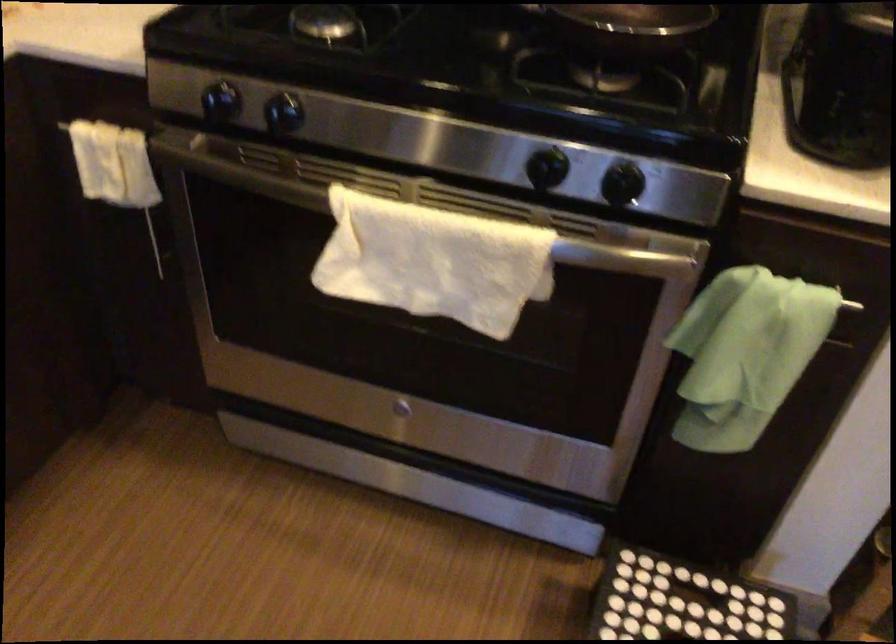
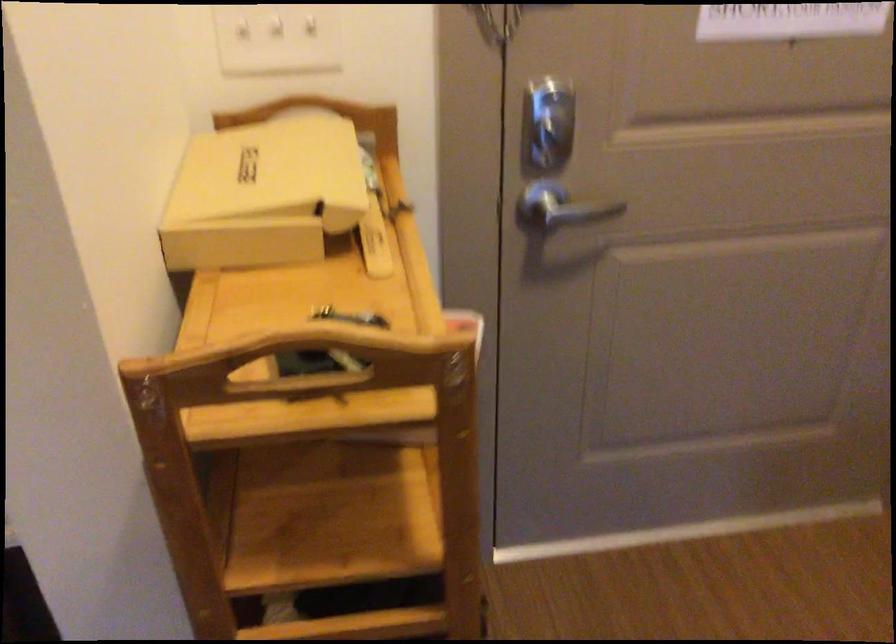
Question: The first image is from the beginning of the video and the second image is from the end. How did the camera likely rotate when shooting the video?

Choices:
 (A) Left
 (B) Right
 (C) Up
 (D) Down

Answer: (B)